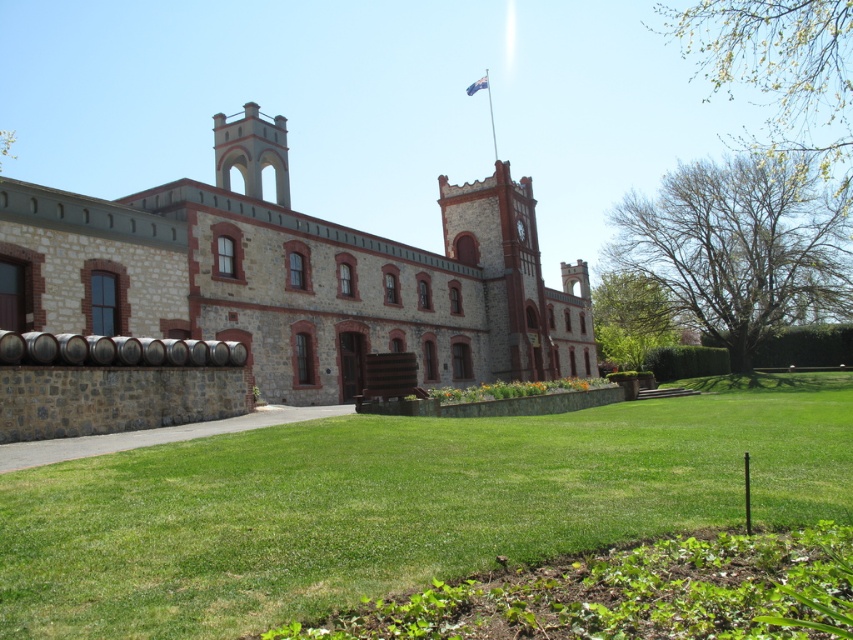
You are standing in front of the building and want to take a photo of both the stone brick winery at center and the smooth stone tower at upper center. Which object will appear larger in your photo?

The stone brick winery at center will appear larger in the photo because it is closer to the viewer than the smooth stone tower at upper center.